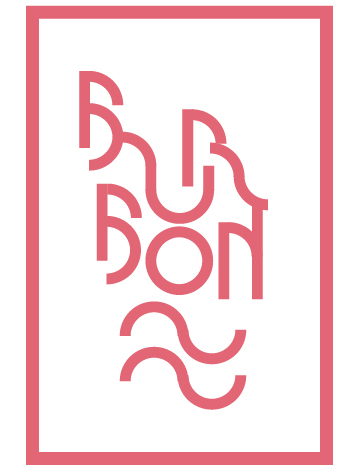
This screenshot has width=341, height=471. I want to click on art, so click(x=214, y=337).